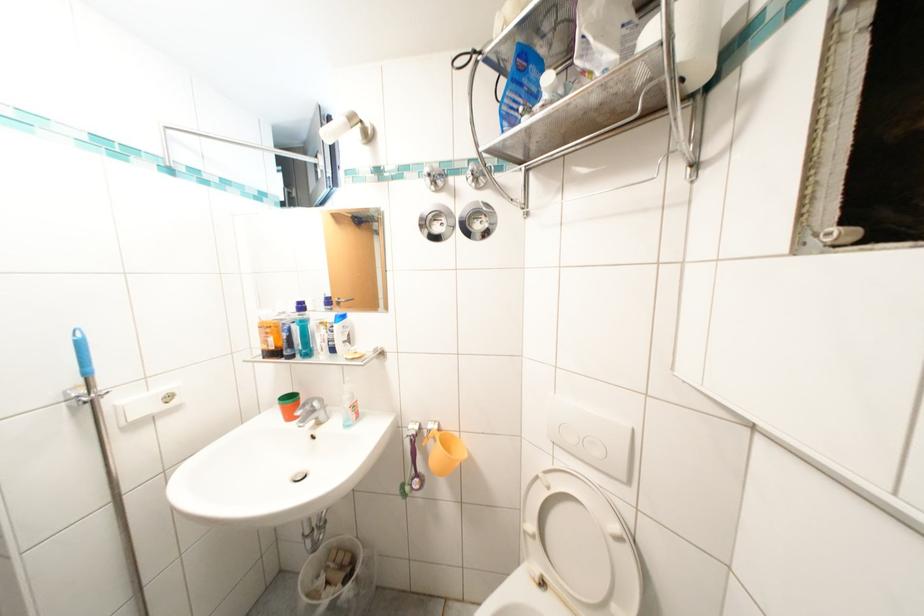
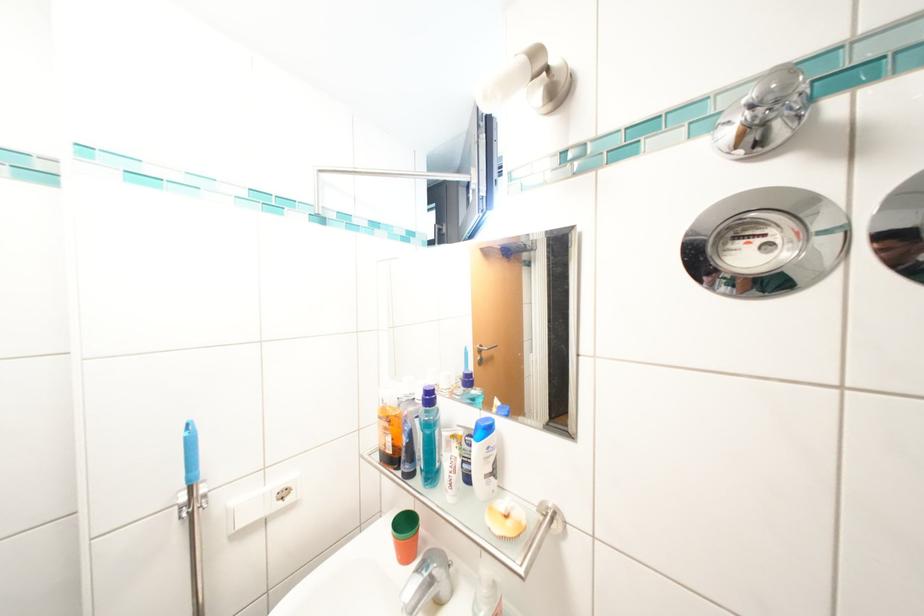
Question: Based on the continuous images, in which direction is the camera rotating? Reply with the corresponding letter.

Choices:
 (A) Left
 (B) Right
 (C) Up
 (D) Down

Answer: (A)